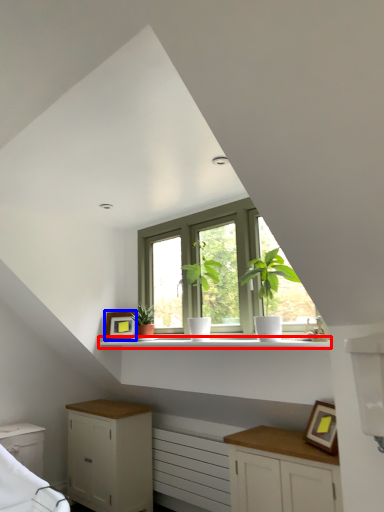
Question: Which point is further to the camera, shelf (highlighted by a red box) or picture frame (highlighted by a blue box)?

Choices:
 (A) shelf
 (B) picture frame

Answer: (B)